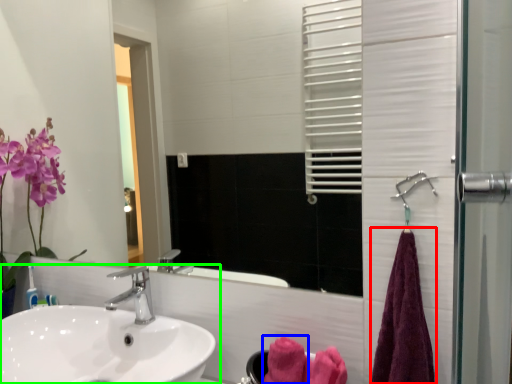
Question: Considering the real-world distances, which object is closest to bath towel (highlighted by a red box)? bath towel (highlighted by a blue box) or sink (highlighted by a green box).

Choices:
 (A) bath towel
 (B) sink

Answer: (A)